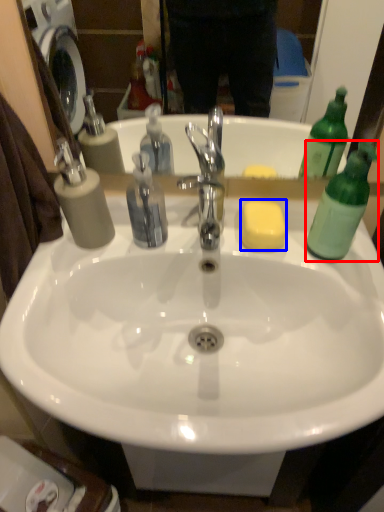
Question: Which of the following is the closest to the observer, bottle (highlighted by a red box) or soap (highlighted by a blue box)?

Choices:
 (A) bottle
 (B) soap

Answer: (A)